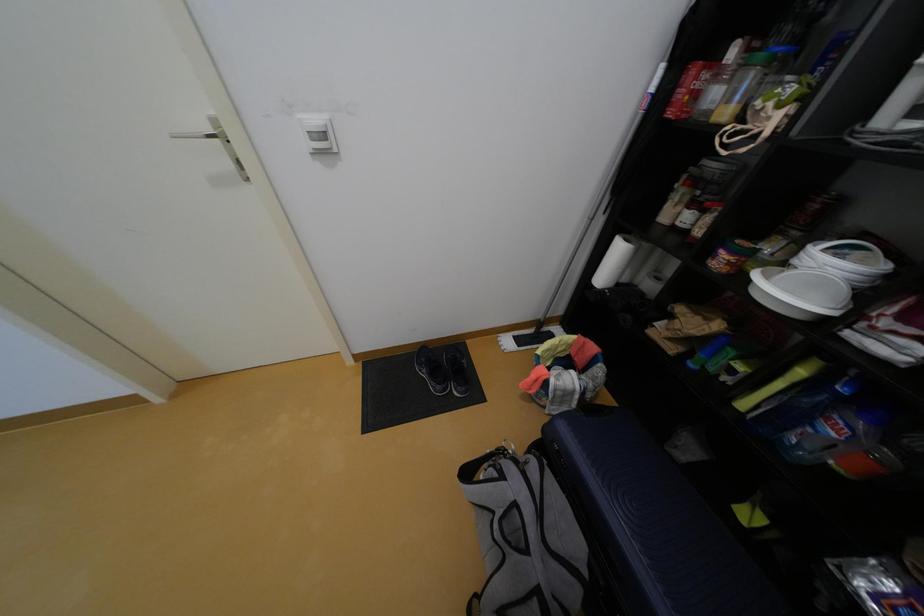
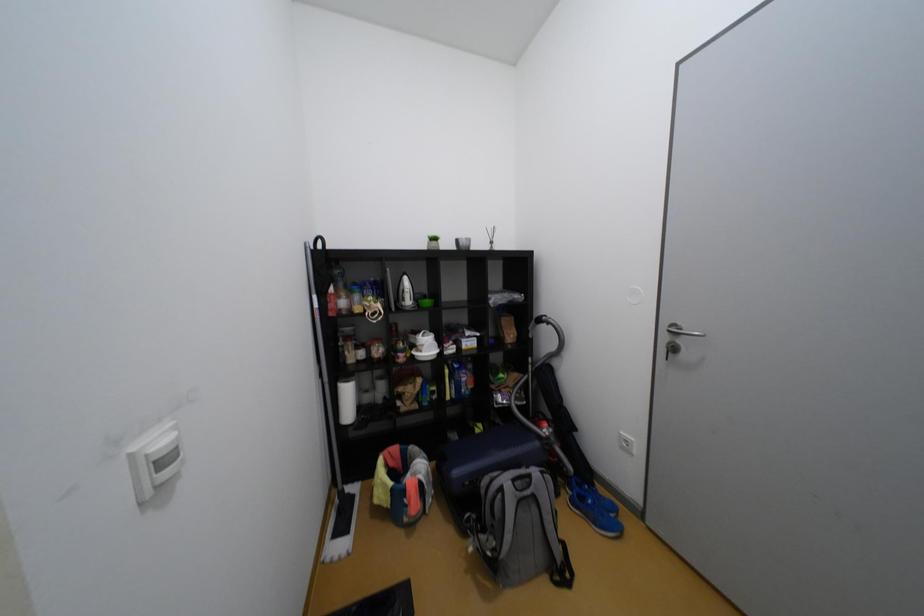
Question: The first image is from the beginning of the video and the second image is from the end. How did the camera likely rotate when shooting the video?

Choices:
 (A) Left
 (B) Right
 (C) Up
 (D) Down

Answer: (B)